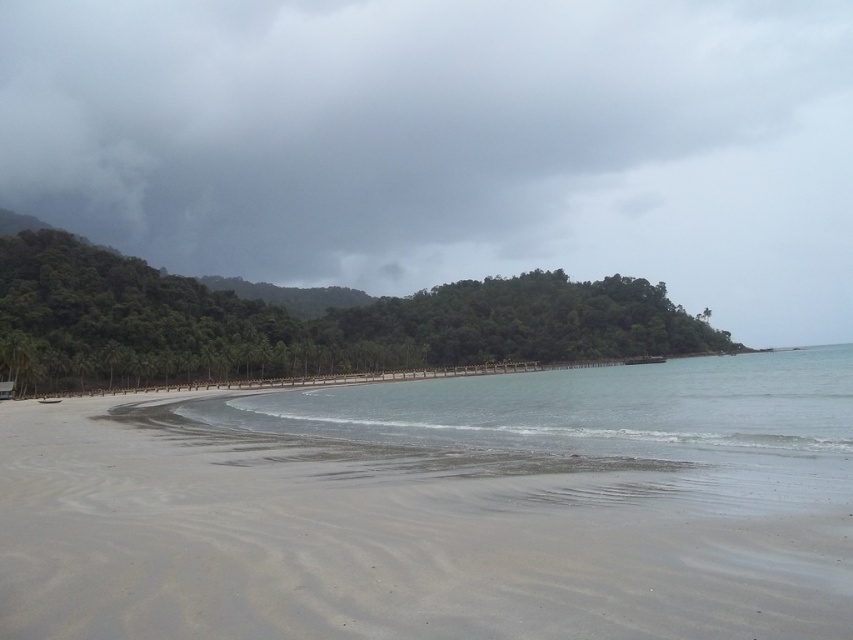
You are standing on the beach and want to reach the green leafy island at center. Which direction should you walk from the smooth sand at lower center?

The smooth sand at lower center is to the left of the green leafy island at center, so you should walk to the right to reach the island.

You are standing on the beach and want to take a photo of the gray cloudy sky at upper center and the smooth sand at lower center. Which object should you point your camera towards first if you want to capture both in one shot?

You should point your camera towards the gray cloudy sky at upper center first because it is located to the right of the smooth sand at lower center, allowing you to frame both objects in the same shot by aligning them horizontally.

You are standing on the beach and want to walk to the green leafy island at center. Is the smooth sand at lower center between you and the island?

Yes, the smooth sand at lower center is between you and the green leafy island at center because the smooth sand at lower center is below the green leafy island at center.